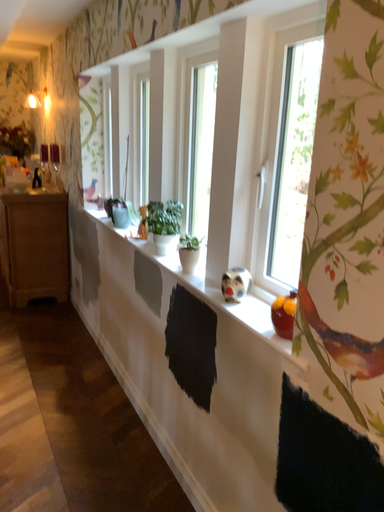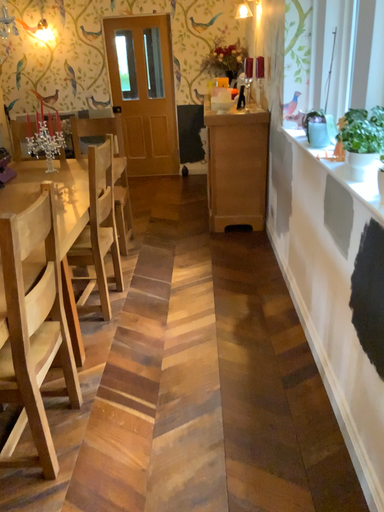
Question: How did the camera likely rotate when shooting the video?

Choices:
 (A) rotated left
 (B) rotated right

Answer: (A)